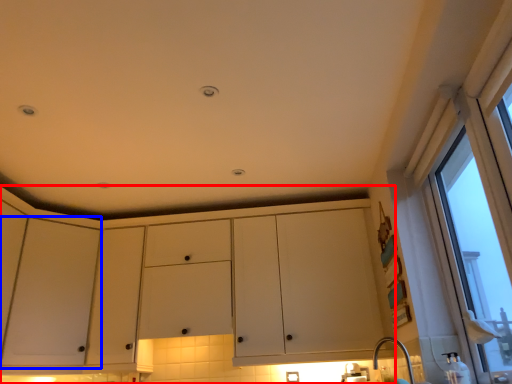
Question: Which of the following is the closest to the observer, cabinetry (highlighted by a red box) or screen door (highlighted by a blue box)?

Choices:
 (A) cabinetry
 (B) screen door

Answer: (B)